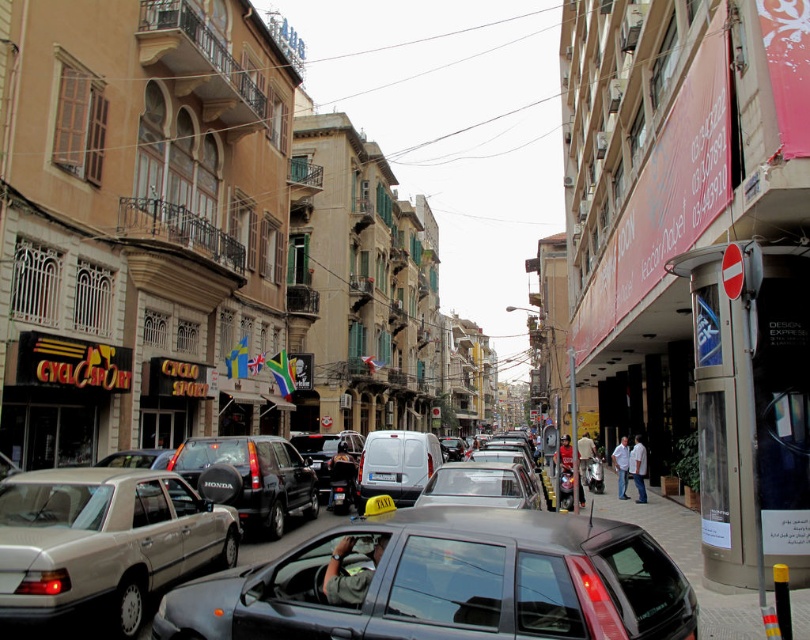
Is silver metallic sedan at center taller than metallic silver car at center?

Yes.

Between silver metallic sedan at center and metallic silver car at center, which one has less height?

With less height is metallic silver car at center.

Describe the element at coordinates (103, 541) in the screenshot. The height and width of the screenshot is (640, 810). I see `silver metallic sedan at center` at that location.

This screenshot has height=640, width=810. Find the location of `silver metallic sedan at center`. silver metallic sedan at center is located at coordinates (103, 541).

Is metallic silver car at center above white plastic license plate at center?

Yes.

Between metallic silver car at center and white plastic license plate at center, which one has more height?

Standing taller between the two is metallic silver car at center.

What do you see at coordinates (480, 484) in the screenshot? The image size is (810, 640). I see `metallic silver car at center` at bounding box center [480, 484].

The image size is (810, 640). Find the location of `metallic silver car at center`. metallic silver car at center is located at coordinates (480, 484).

Between point (271, 452) and point (488, 477), which one is positioned behind?

Point (271, 452)

What do you see at coordinates (254, 477) in the screenshot? I see `matte black suv at center` at bounding box center [254, 477].

Image resolution: width=810 pixels, height=640 pixels. What are the coordinates of `matte black suv at center` in the screenshot? It's located at (254, 477).